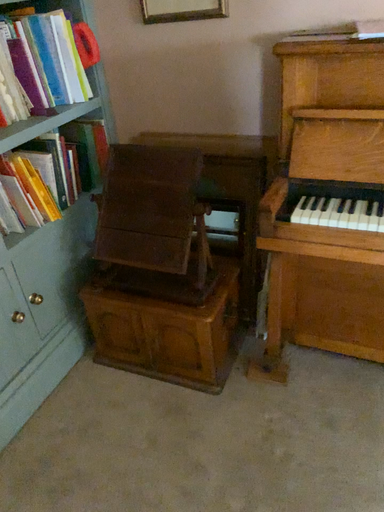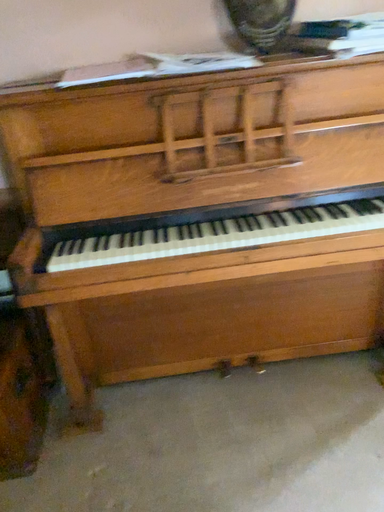
Question: How did the camera likely rotate when shooting the video?

Choices:
 (A) rotated downward
 (B) rotated upward

Answer: (B)